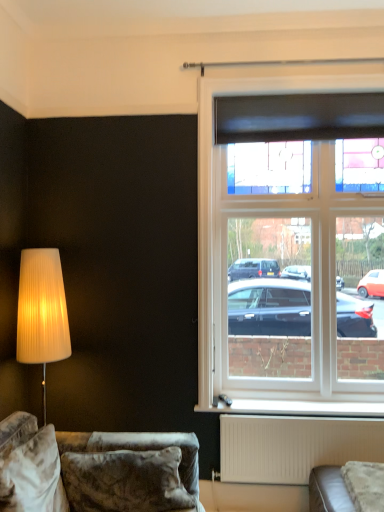
I want to click on empty space that is ontop of stained glass window at upper right (from a real-world perspective), so click(302, 72).